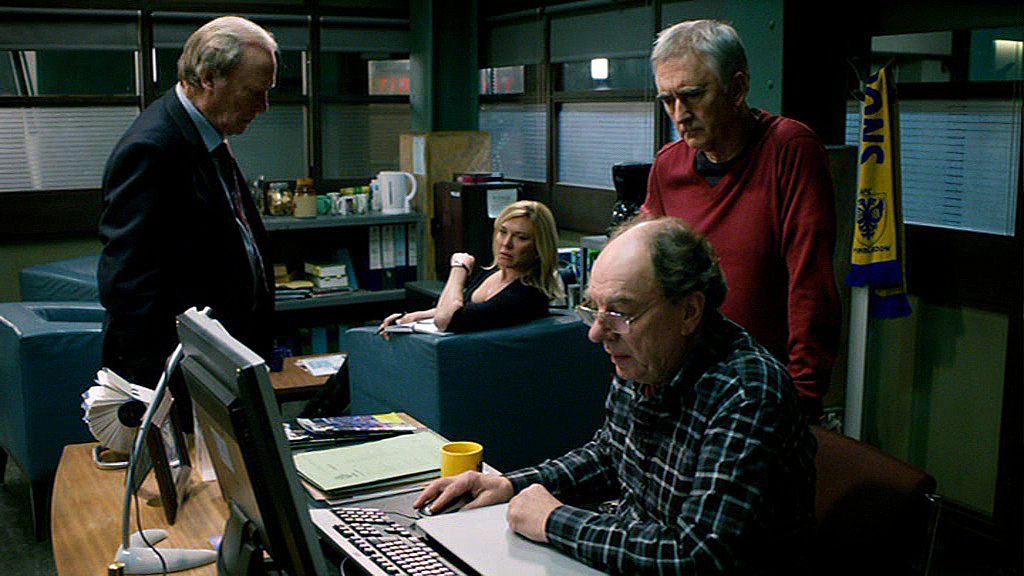
This screenshot has height=576, width=1024. I want to click on table, so click(104, 507).